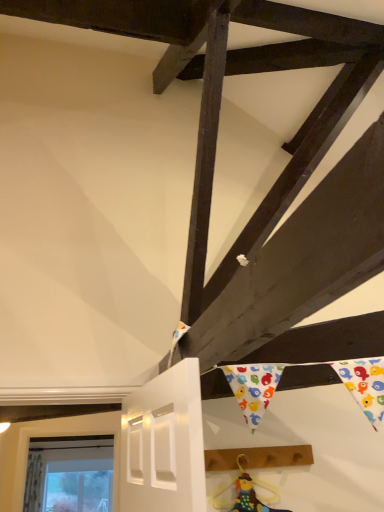
The width and height of the screenshot is (384, 512). What do you see at coordinates (246, 492) in the screenshot?
I see `multicolored fabric doll at lower center` at bounding box center [246, 492].

In order to click on multicolored fabric doll at lower center in this screenshot , I will do `click(246, 492)`.

You are a GUI agent. You are given a task and a screenshot of the screen. Output one action in this format:
    pyautogui.click(x=<x>, y=<y>)
    Task: Click on the brown wooden plank at lower right
    This screenshot has width=384, height=512.
    Given the screenshot: What is the action you would take?
    pyautogui.click(x=258, y=457)

This screenshot has width=384, height=512. Describe the element at coordinates (258, 457) in the screenshot. I see `brown wooden plank at lower right` at that location.

This screenshot has width=384, height=512. I want to click on multicolored fabric doll at lower center, so click(x=246, y=492).

Based on their positions, is brown wooden plank at lower right located to the left or right of multicolored fabric doll at lower center?

brown wooden plank at lower right is to the right of multicolored fabric doll at lower center.

Which object is further away from the camera, brown wooden plank at lower right or multicolored fabric doll at lower center?

brown wooden plank at lower right is further away from the camera.

Considering the points (284, 455) and (241, 476), which point is in front, point (284, 455) or point (241, 476)?

The point (241, 476) is closer to the camera.

From the image's perspective, is brown wooden plank at lower right located above multicolored fabric doll at lower center?

Yes, from the image's perspective, brown wooden plank at lower right is over multicolored fabric doll at lower center.

From a real-world perspective, is brown wooden plank at lower right located higher than multicolored fabric doll at lower center?

Correct, in the physical world, brown wooden plank at lower right is higher than multicolored fabric doll at lower center.

Is brown wooden plank at lower right thinner than multicolored fabric doll at lower center?

Incorrect, the width of brown wooden plank at lower right is not less than that of multicolored fabric doll at lower center.

Is brown wooden plank at lower right taller than multicolored fabric doll at lower center?

No, brown wooden plank at lower right is not taller than multicolored fabric doll at lower center.

Who is bigger, brown wooden plank at lower right or multicolored fabric doll at lower center?

Bigger between the two is brown wooden plank at lower right.

Is brown wooden plank at lower right outside of multicolored fabric doll at lower center?

Yes.

Consider the image. Is brown wooden plank at lower right next to multicolored fabric doll at lower center and touching it?

Yes.

Is brown wooden plank at lower right oriented away from multicolored fabric doll at lower center?

No, brown wooden plank at lower right is not facing the opposite direction of multicolored fabric doll at lower center.

How many degrees apart are the facing directions of brown wooden plank at lower right and multicolored fabric doll at lower center?

1.14 degrees.

How far apart are brown wooden plank at lower right and multicolored fabric doll at lower center?

brown wooden plank at lower right is 3.60 inches away from multicolored fabric doll at lower center.

At what (x,y) coordinates should I click in order to perform the action: click on plank above the multicolored fabric doll at lower center (from the image's perspective). Please return your answer as a coordinate pair (x, y). Image resolution: width=384 pixels, height=512 pixels. Looking at the image, I should click on (258, 457).

Considering the positions of objects multicolored fabric doll at lower center and brown wooden plank at lower right in the image provided, who is more to the right, multicolored fabric doll at lower center or brown wooden plank at lower right?

Positioned to the right is brown wooden plank at lower right.

In the image, is multicolored fabric doll at lower center positioned in front of or behind brown wooden plank at lower right?

In the image, multicolored fabric doll at lower center appears in front of brown wooden plank at lower right.

Considering the points (277, 490) and (220, 468), which point is behind, point (277, 490) or point (220, 468)?

Positioned behind is point (277, 490).

From the image's perspective, between multicolored fabric doll at lower center and brown wooden plank at lower right, which one is located above?

From the image's view, brown wooden plank at lower right is above.

From a real-world perspective, which is physically below, multicolored fabric doll at lower center or brown wooden plank at lower right?

From a 3D spatial view, multicolored fabric doll at lower center is below.

Can you confirm if multicolored fabric doll at lower center is wider than brown wooden plank at lower right?

In fact, multicolored fabric doll at lower center might be narrower than brown wooden plank at lower right.

Considering the sizes of multicolored fabric doll at lower center and brown wooden plank at lower right in the image, is multicolored fabric doll at lower center taller or shorter than brown wooden plank at lower right?

Considering their sizes, multicolored fabric doll at lower center has more height than brown wooden plank at lower right.

Between multicolored fabric doll at lower center and brown wooden plank at lower right, which one has smaller size?

Smaller between the two is multicolored fabric doll at lower center.

Would you say multicolored fabric doll at lower center is outside brown wooden plank at lower right?

Yes, multicolored fabric doll at lower center is located beyond the bounds of brown wooden plank at lower right.

Looking at this image, are multicolored fabric doll at lower center and brown wooden plank at lower right making contact?

Yes, multicolored fabric doll at lower center is beside brown wooden plank at lower right.

Is multicolored fabric doll at lower center facing towards brown wooden plank at lower right?

No, multicolored fabric doll at lower center does not turn towards brown wooden plank at lower right.

Based on the photo, how different are the orientations of multicolored fabric doll at lower center and brown wooden plank at lower right in degrees?

1.14 degrees.

How distant is multicolored fabric doll at lower center from brown wooden plank at lower right?

3.60 inches.

At what (x,y) coordinates should I click in order to perform the action: click on plank above the multicolored fabric doll at lower center (from the image's perspective). Please return your answer as a coordinate pair (x, y). This screenshot has width=384, height=512. Looking at the image, I should click on click(x=258, y=457).

You are a GUI agent. You are given a task and a screenshot of the screen. Output one action in this format:
    pyautogui.click(x=<x>, y=<y>)
    Task: Click on the plank positioned vertically above the multicolored fabric doll at lower center (from a real-world perspective)
    
    Given the screenshot: What is the action you would take?
    pyautogui.click(x=258, y=457)

Identify the location of doll that is on the left side of brown wooden plank at lower right. (246, 492).